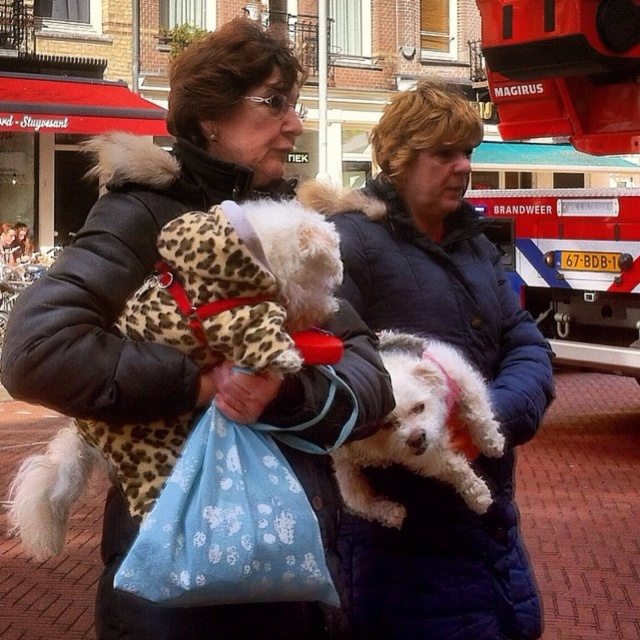
You are a photographer trying to capture a photo of the white fur dog at center without the brushed metal fire truck at upper right appearing in the frame. Based on their positions, is this possible?

The brushed metal fire truck at upper right is above the white fur dog at center, so if you position your camera to focus on the dog while angling it downward, you can avoid including the fire truck in the shot.

Consider the image. You are a fashion designer observing two women walking with their dogs. You notice the blue quilted jacket at center and the white fluffy dog at center. Which item has a greater width?

The blue quilted jacket at center has a greater width than the white fluffy dog at center according to the description.

You are a photographer standing on the sidewalk. You want to take a photo of the blue quilted jacket at center and the white fluffy dog at center. If your camera has a maximum focus range of 35 inches, will you be able to capture both subjects in focus?

The distance between the blue quilted jacket at center and the white fluffy dog at center is 37.47 inches, which exceeds the camera maximum focus range of 35 inches. Therefore, you won not be able to capture both subjects in focus.